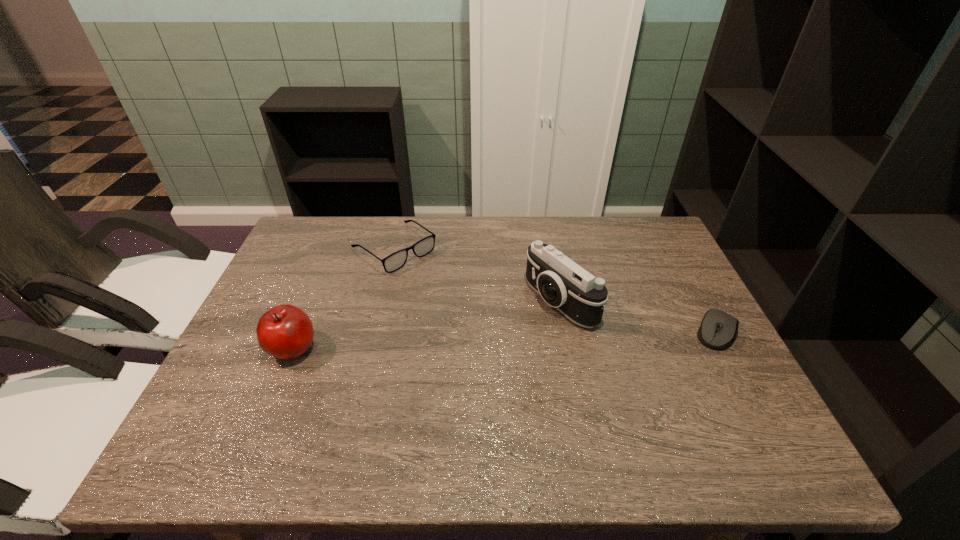
Identify the location of vacant space in between the third shortest object and the spectacles. The image size is (960, 540). (344, 298).

Select which object is the second closest to the rightmost object. Please provide its 2D coordinates. Your answer should be formatted as a tuple, i.e. [(x, y)], where the tuple contains the x and y coordinates of a point satisfying the conditions above.

[(395, 261)]

At what (x,y) coordinates should I click in order to perform the action: click on object that stands as the second closest to the spectacles. Please return your answer as a coordinate pair (x, y). Looking at the image, I should click on (563, 284).

You are a GUI agent. You are given a task and a screenshot of the screen. Output one action in this format:
    pyautogui.click(x=<x>, y=<y>)
    Task: Click on the free space that satisfies the following two spatial constraints: 1. on the front side of the shortest object; 2. on the right side of the second shortest object
    The image size is (960, 540).
    Given the screenshot: What is the action you would take?
    pyautogui.click(x=374, y=332)

Locate an element on the screen. The image size is (960, 540). free point that satisfies the following two spatial constraints: 1. on the front side of the third tallest object; 2. on the right side of the rightmost object is located at coordinates (374, 332).

The width and height of the screenshot is (960, 540). What are the coordinates of `free space that satisfies the following two spatial constraints: 1. on the front side of the third object from left to right; 2. on the right side of the second shortest object` in the screenshot? It's located at (381, 301).

Find the location of a particular element. This screenshot has width=960, height=540. vacant point that satisfies the following two spatial constraints: 1. on the back side of the third object from left to right; 2. on the left side of the apple is located at coordinates (312, 301).